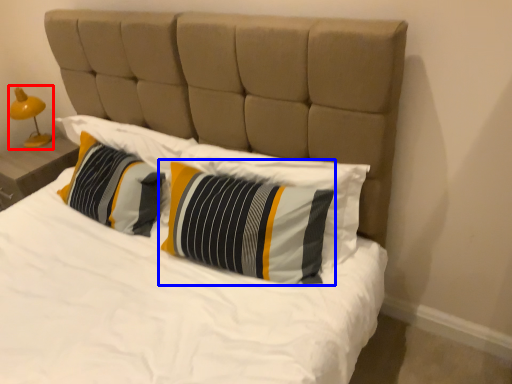
Question: Which point is further to the camera, bedside lamp (highlighted by a red box) or pillow (highlighted by a blue box)?

Choices:
 (A) bedside lamp
 (B) pillow

Answer: (A)